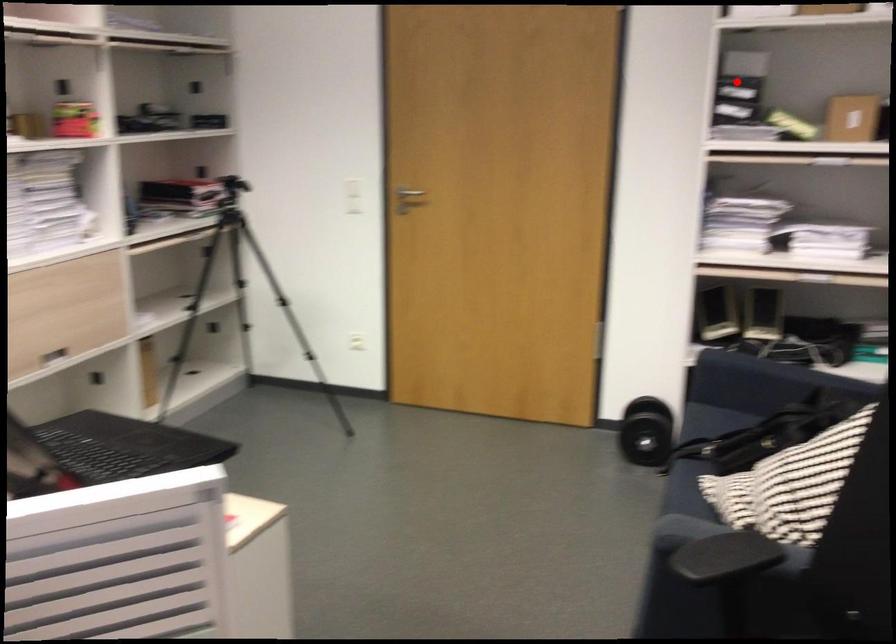
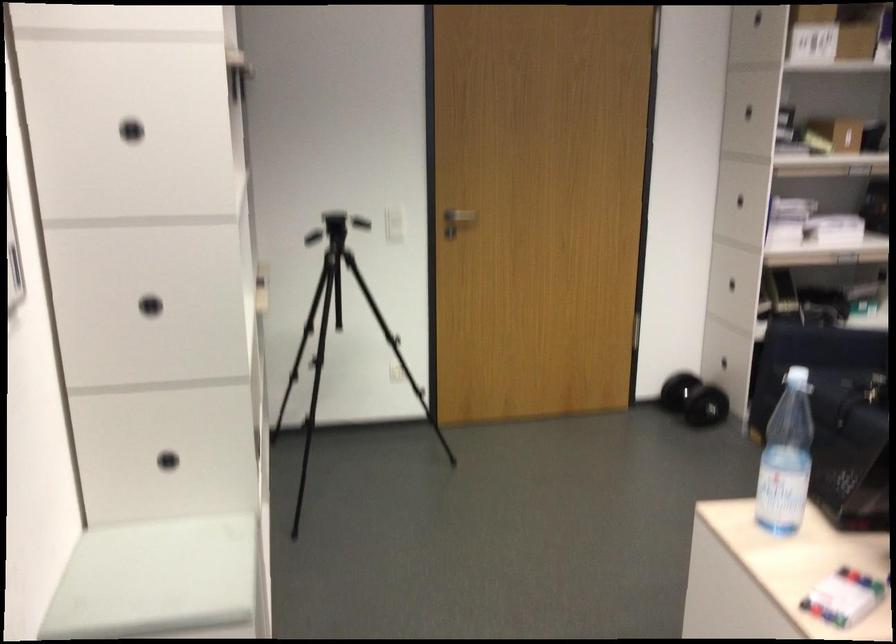
Find the pixel in the second image that matches the highlighted location in the first image.

(747, 111)